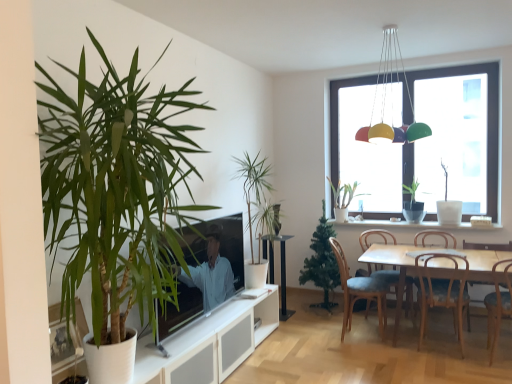
Where is `free spot to the right of black glass table at center`? The image size is (512, 384). free spot to the right of black glass table at center is located at coordinates (303, 317).